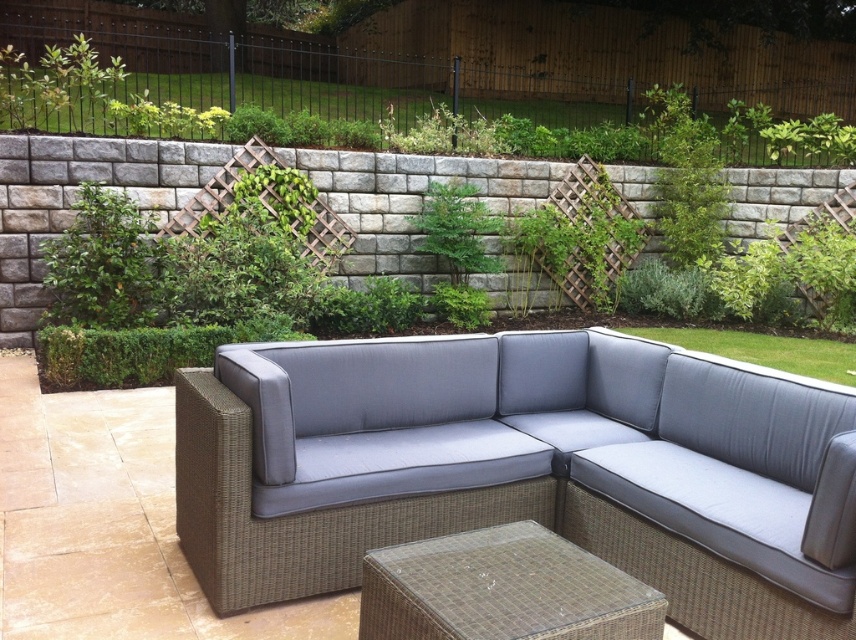
You are a guest sitting on the woven rattan couch at center and want to reach the woven rattan side table at lower center to grab a drink. Can you easily reach it without moving from your seat?

The woven rattan side table at lower center is behind the woven rattan couch at center, so you cannot easily reach it without moving from your seat.

You are standing in the garden and want to sit down on the woven rattan couch at center. Based on the coordinates provided, can you confirm if the point at (522, 468) is a valid sitting spot on the couch?

The point at (522, 468) is on the woven rattan couch at center, so yes, it is a valid sitting spot.

You are planning to place a large potted plant between the woven rattan couch at center and the woven rattan side table at lower center. Based on their positions, which side of the side table should the plant be placed on?

The woven rattan couch at center is positioned on the left side of the woven rattan side table at lower center, so the large potted plant should be placed on the right side of the side table to maintain symmetry between the couch and the plant.